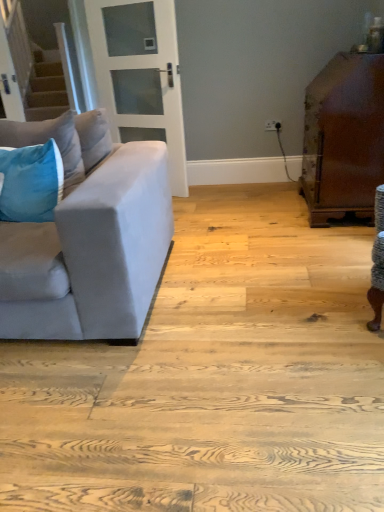
You are a GUI agent. You are given a task and a screenshot of the screen. Output one action in this format:
    pyautogui.click(x=<x>, y=<y>)
    Task: Click on the free spot to the left of glossy brown wooden cabinet at right
    The width and height of the screenshot is (384, 512).
    Given the screenshot: What is the action you would take?
    pyautogui.click(x=250, y=215)